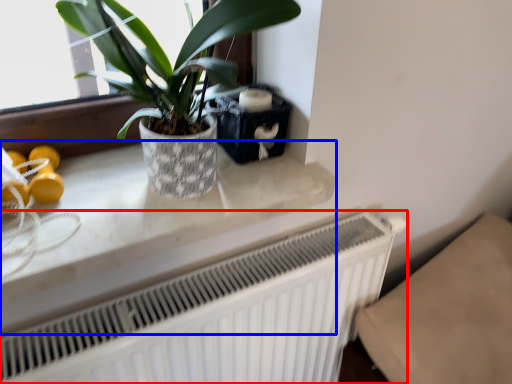
Question: Which object is further to the camera taking this photo, radiator (highlighted by a red box) or counter top (highlighted by a blue box)?

Choices:
 (A) radiator
 (B) counter top

Answer: (A)